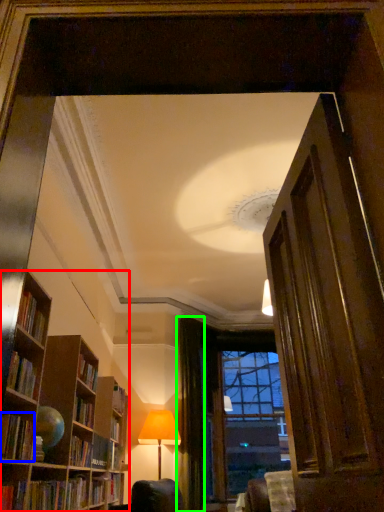
Question: Estimate the real-world distances between objects in this image. Which object is farther from bookcase (highlighted by a red box), book (highlighted by a blue box) or curtain (highlighted by a green box)?

Choices:
 (A) book
 (B) curtain

Answer: (B)